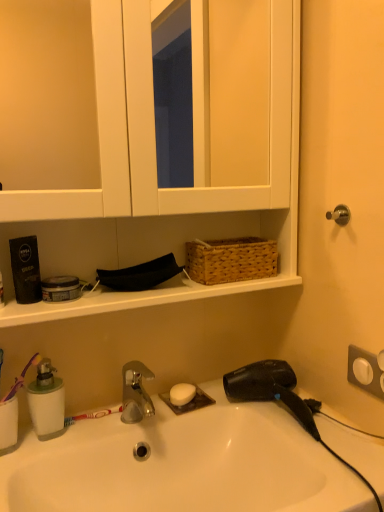
Locate an element on the screen. blank area beneath white matte medicine cabinet at upper center (from a real-world perspective) is located at coordinates (150, 404).